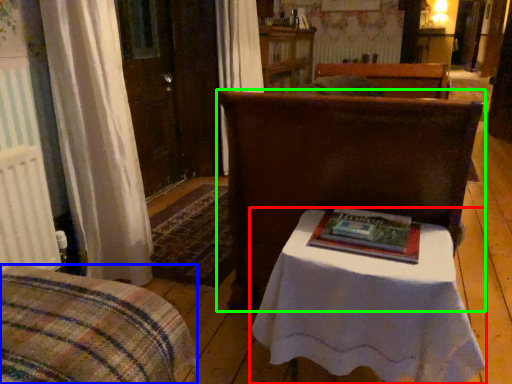
Question: Estimate the real-world distances between objects in this image. Which object is farther from table (highlighted by a red box), furniture (highlighted by a blue box) or furniture (highlighted by a green box)?

Choices:
 (A) furniture
 (B) furniture

Answer: (A)